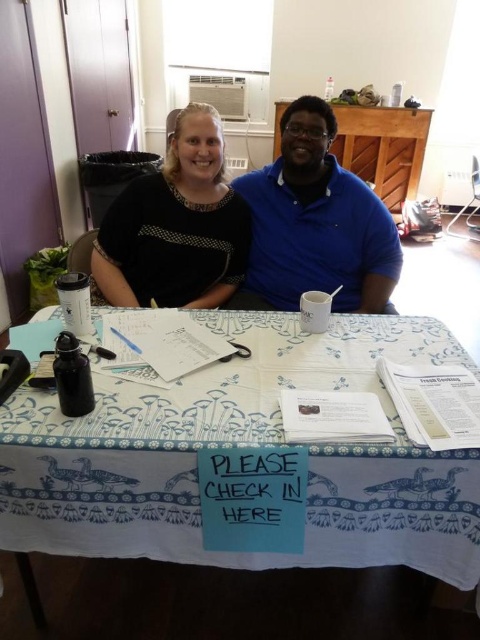
From the picture: Does blue cotton shirt at center have a greater height compared to black dotted shirt at upper left?

Indeed, blue cotton shirt at center has a greater height compared to black dotted shirt at upper left.

Who is more forward, [338,296] or [156,237]?

Point [156,237] is more forward.

Where is `blue cotton shirt at center`? The height and width of the screenshot is (640, 480). blue cotton shirt at center is located at coordinates (314, 224).

Who is positioned more to the right, white printed fabric at center or blue cotton shirt at center?

blue cotton shirt at center is more to the right.

Is white printed fabric at center to the left of blue cotton shirt at center from the viewer's perspective?

Yes, white printed fabric at center is to the left of blue cotton shirt at center.

Identify the location of white printed fabric at center. (242, 444).

Does white printed fabric at center have a lesser height compared to black dotted shirt at upper left?

Yes.

Does white printed fabric at center appear on the left side of black dotted shirt at upper left?

In fact, white printed fabric at center is to the right of black dotted shirt at upper left.

Is point (276, 554) positioned before point (211, 243)?

Yes, point (276, 554) is in front of point (211, 243).

Where is `white printed fabric at center`? white printed fabric at center is located at coordinates (242, 444).